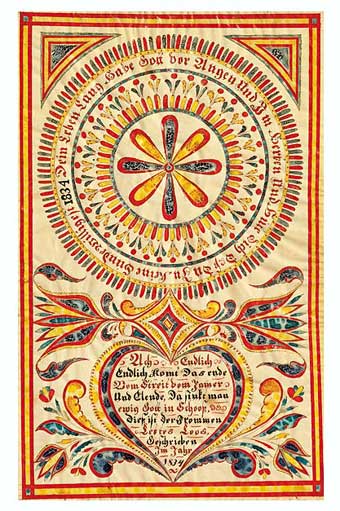
This screenshot has height=511, width=340. Identify the location of yellow  bar. (201, 490).